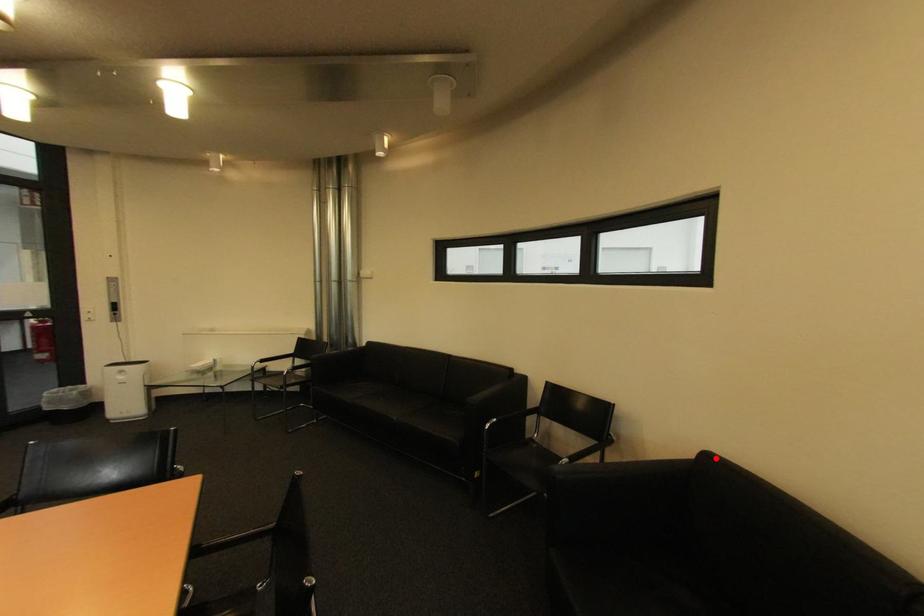
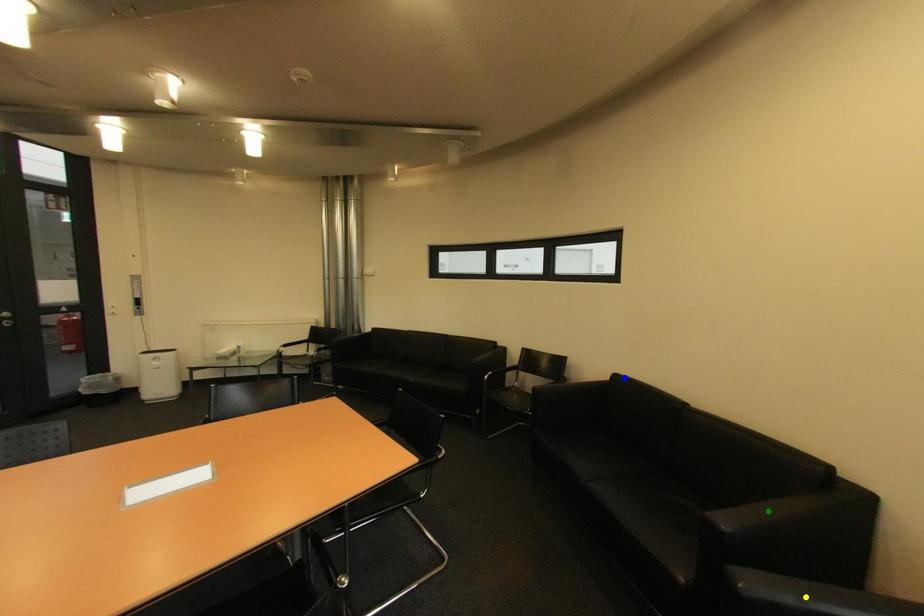
Question: I am providing you with two images of the same scene from different viewpoints. A red point is marked on the first image. You are given multiple points on the second image. Can you choose the point in image 2 that corresponds to the point in image 1?

Choices:
 (A) blue point
 (B) yellow point
 (C) green point

Answer: (A)